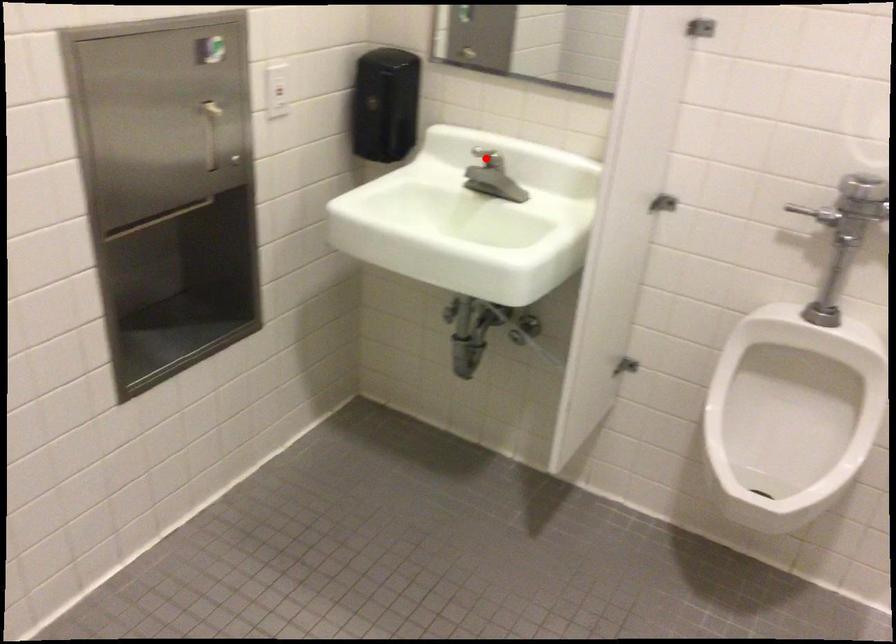
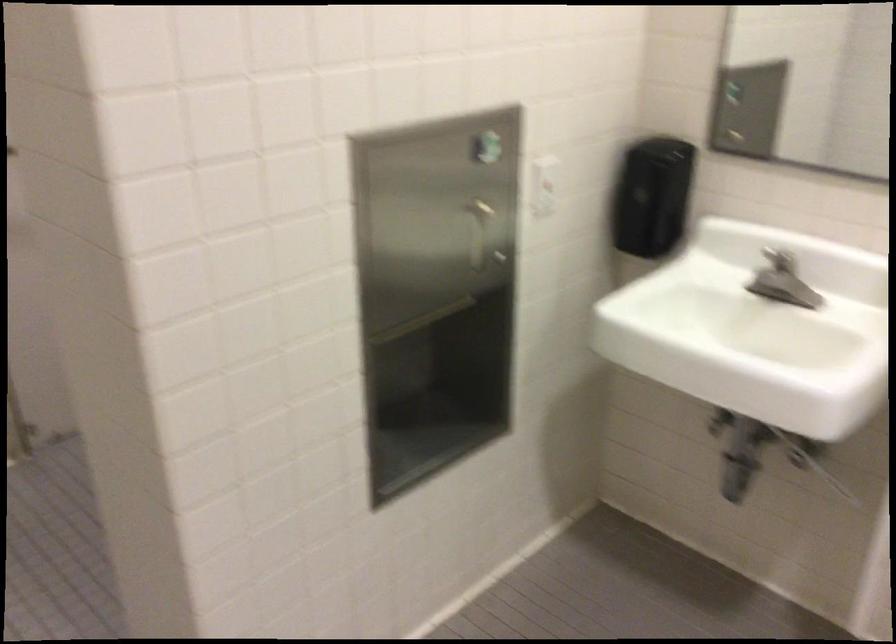
Where in the second image is the point corresponding to the highlighted location from the first image?

(778, 259)